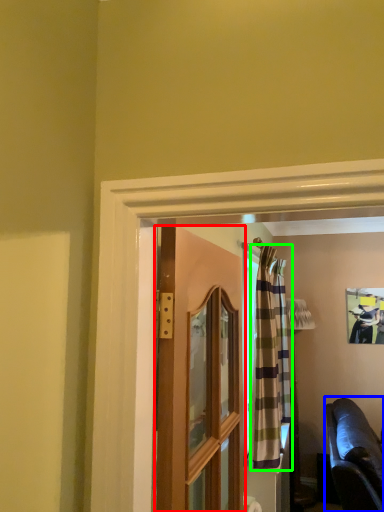
Question: Considering the real-world distances, which object is closest to door (highlighted by a red box)? studio couch (highlighted by a blue box) or curtain (highlighted by a green box).

Choices:
 (A) studio couch
 (B) curtain

Answer: (B)